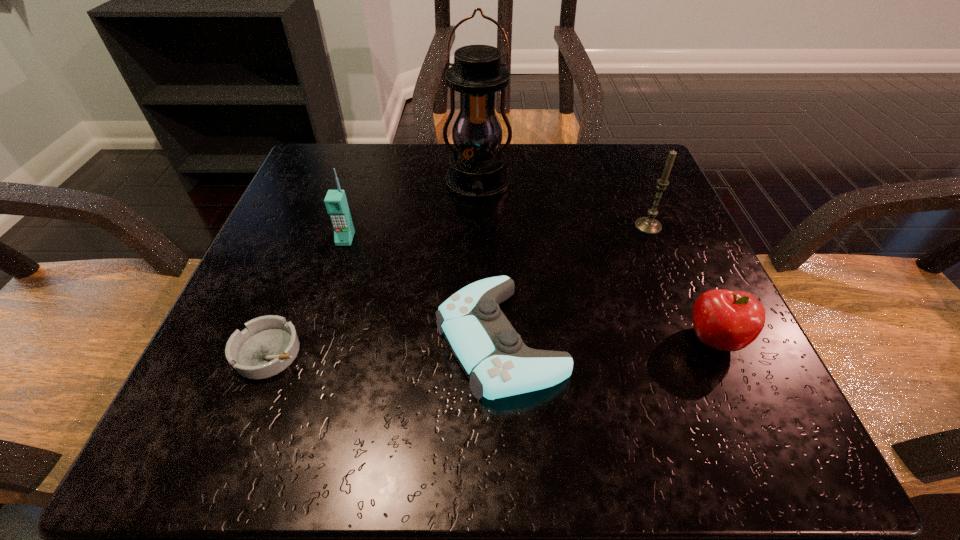
This screenshot has width=960, height=540. Find the location of `the farthest object`. the farthest object is located at coordinates (477, 169).

Locate an element on the screen. The height and width of the screenshot is (540, 960). lantern is located at coordinates (477, 169).

Find the location of a particular element. Image resolution: width=960 pixels, height=540 pixels. candle is located at coordinates (649, 225).

Where is `cellular telephone`? cellular telephone is located at coordinates (336, 204).

Locate an element on the screen. the fourth tallest object is located at coordinates (726, 320).

Image resolution: width=960 pixels, height=540 pixels. Find the location of `control`. control is located at coordinates (491, 353).

You are a GUI agent. You are given a task and a screenshot of the screen. Output one action in this format:
    pyautogui.click(x=<x>, y=<y>)
    Task: Click on the ashtray
    The width and height of the screenshot is (960, 540).
    Given the screenshot: What is the action you would take?
    pyautogui.click(x=269, y=344)

Locate several points within vacant space situated 0.350m above the farthest object, indicating its light source. Please provide its 2D coordinates. Your answer should be formatted as a tuple, i.e. [(x, y)], where the tuple contains the x and y coordinates of a point satisfying the conditions above.

[(477, 362)]

In order to click on vacant point located on the back of the candle in this screenshot , I will do `click(626, 173)`.

You are a GUI agent. You are given a task and a screenshot of the screen. Output one action in this format:
    pyautogui.click(x=<x>, y=<y>)
    Task: Click on the free space located on the keypad of the cellular telephone
    
    Given the screenshot: What is the action you would take?
    pyautogui.click(x=294, y=400)